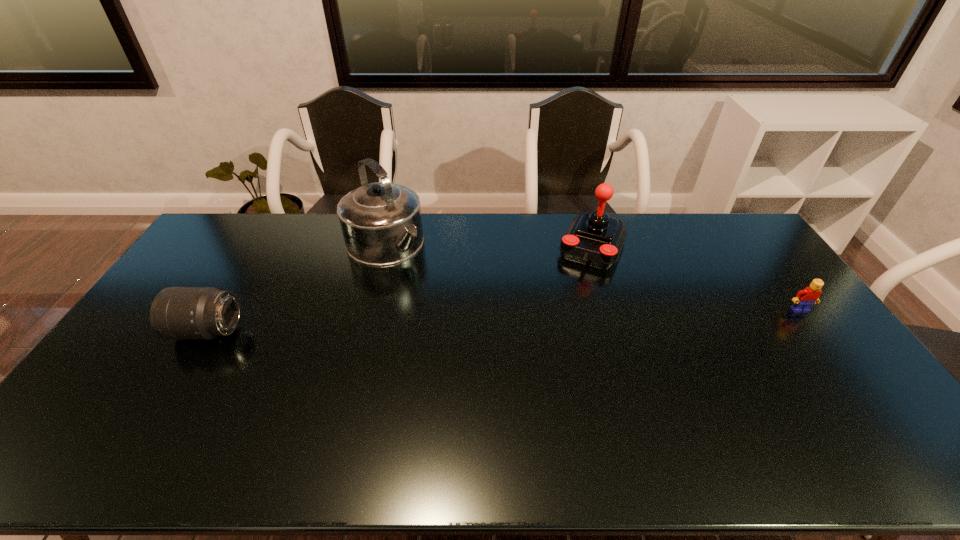
Identify the location of unoccupied position between the second object from right to left and the leftmost object. The image size is (960, 540). (401, 288).

You are a GUI agent. You are given a task and a screenshot of the screen. Output one action in this format:
    pyautogui.click(x=<x>, y=<y>)
    Task: Click on the vacant area that lies between the Lego and the kettle
    Image resolution: width=960 pixels, height=540 pixels.
    Given the screenshot: What is the action you would take?
    pyautogui.click(x=592, y=277)

At what (x,y) coordinates should I click in order to perform the action: click on vacant space that's between the second object from right to left and the third object from right to left. Please return your answer as a coordinate pair (x, y). This screenshot has width=960, height=540. Looking at the image, I should click on (489, 245).

The width and height of the screenshot is (960, 540). I want to click on vacant area between the third shortest object and the telephoto lens, so click(x=401, y=288).

The height and width of the screenshot is (540, 960). Identify the location of free space between the tallest object and the joystick. (x=489, y=245).

In order to click on vacant space that is in between the leftmost object and the third object from left to right in this screenshot , I will do `click(401, 288)`.

Locate an element on the screen. This screenshot has width=960, height=540. object that is the second closest one to the leftmost object is located at coordinates (596, 239).

Select which object appears as the closest to the rightmost object. Please provide its 2D coordinates. Your answer should be formatted as a tuple, i.e. [(x, y)], where the tuple contains the x and y coordinates of a point satisfying the conditions above.

[(596, 239)]